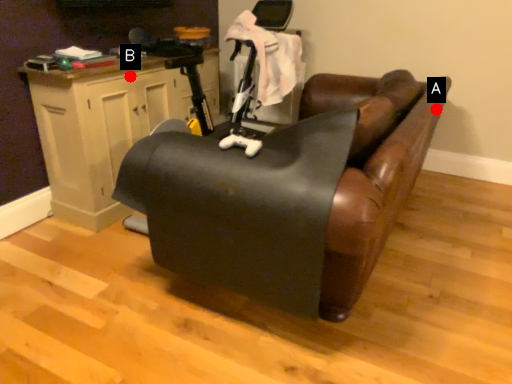
Question: Two points are circled on the image, labeled by A and B beside each circle. Which point is farther to the camera?

Choices:
 (A) A is further
 (B) B is further

Answer: (B)